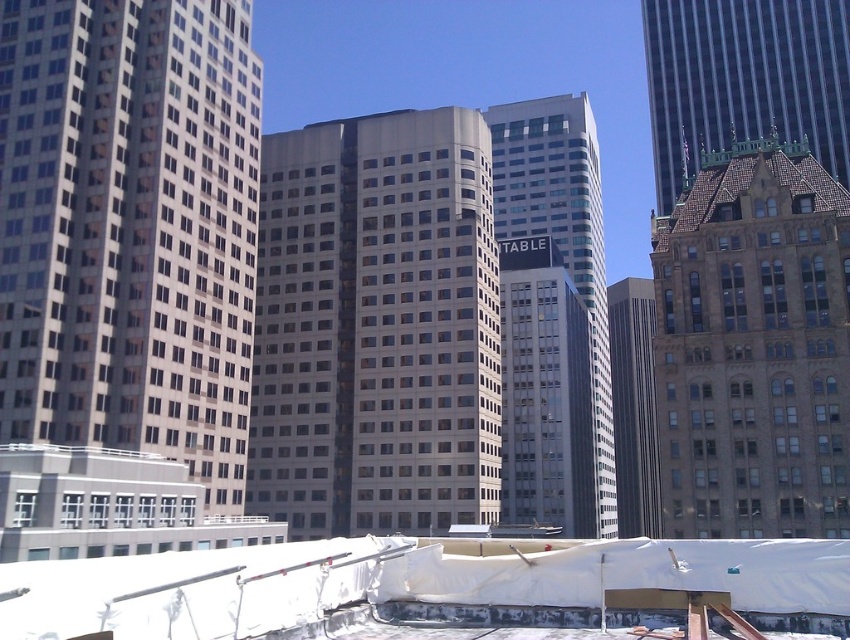
Question: From the image, what is the correct spatial relationship of white fabric at lower center in relation to brown stone tower at upper right?

Choices:
 (A) above
 (B) below

Answer: (B)

Question: Which object is closer to the camera taking this photo?

Choices:
 (A) brown glassy building at center-right
 (B) brown stone tower at upper right
 (C) beige glass building at center

Answer: (A)

Question: Is brown stone tower at upper right above gray glass skyscraper at center?

Choices:
 (A) no
 (B) yes

Answer: (B)

Question: Which object appears closest to the camera in this image?

Choices:
 (A) brown stone tower at upper right
 (B) brown glassy building at center-right
 (C) gray glass skyscraper at center
 (D) white fabric at lower center

Answer: (D)

Question: Based on their relative distances, which object is farther from the gray glass skyscraper at center?

Choices:
 (A) brown stone building at right
 (B) beige glass building at center
 (C) matte glass building at center

Answer: (A)

Question: Is brown stone tower at upper right thinner than matte glass building at center?

Choices:
 (A) no
 (B) yes

Answer: (A)